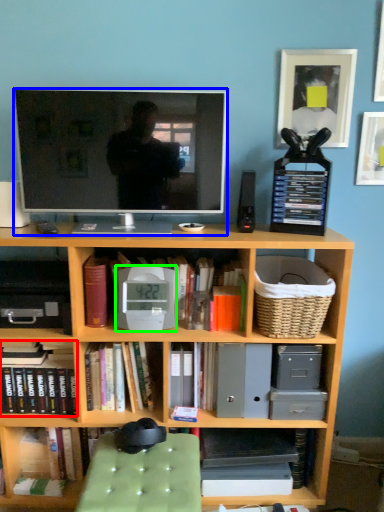
Question: Estimate the real-world distances between objects in this image. Which object is farther from book (highlighted by a red box), television (highlighted by a blue box) or alarm clock (highlighted by a green box)?

Choices:
 (A) television
 (B) alarm clock

Answer: (A)